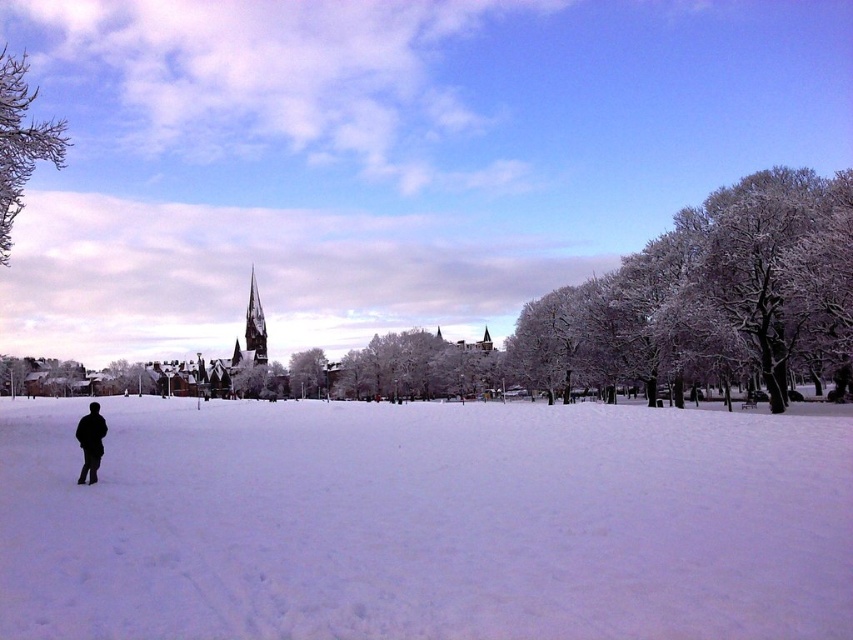
Question: Is white fluffy snow at center bigger than dark brown wooden spire at center?

Choices:
 (A) yes
 (B) no

Answer: (A)

Question: Which point appears closest to the camera in this image?

Choices:
 (A) (57, 138)
 (B) (254, 312)
 (C) (91, 472)

Answer: (C)

Question: Is black matte jacket at lower left positioned in front of dark brown wooden spire at center?

Choices:
 (A) no
 (B) yes

Answer: (B)

Question: Which object is the farthest from the white fluffy snow at center?

Choices:
 (A) frosty white branches at upper left
 (B) dark brown wooden spire at center

Answer: (B)

Question: Is white fluffy snow at center above dark brown wooden spire at center?

Choices:
 (A) no
 (B) yes

Answer: (A)

Question: Which object is farther from the camera taking this photo?

Choices:
 (A) dark brown wooden spire at center
 (B) white fluffy snow at center
 (C) black matte jacket at lower left
 (D) frosty white branches at upper left

Answer: (A)